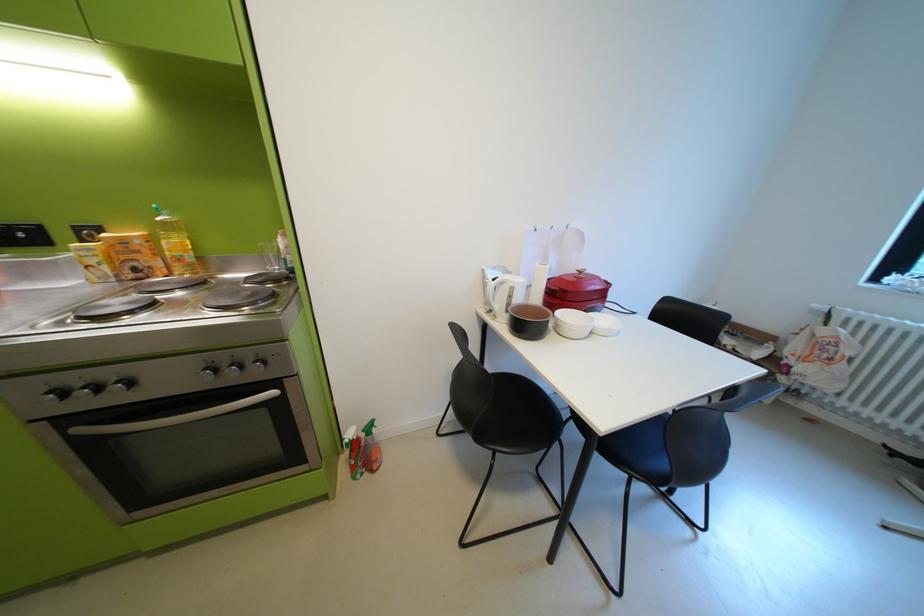
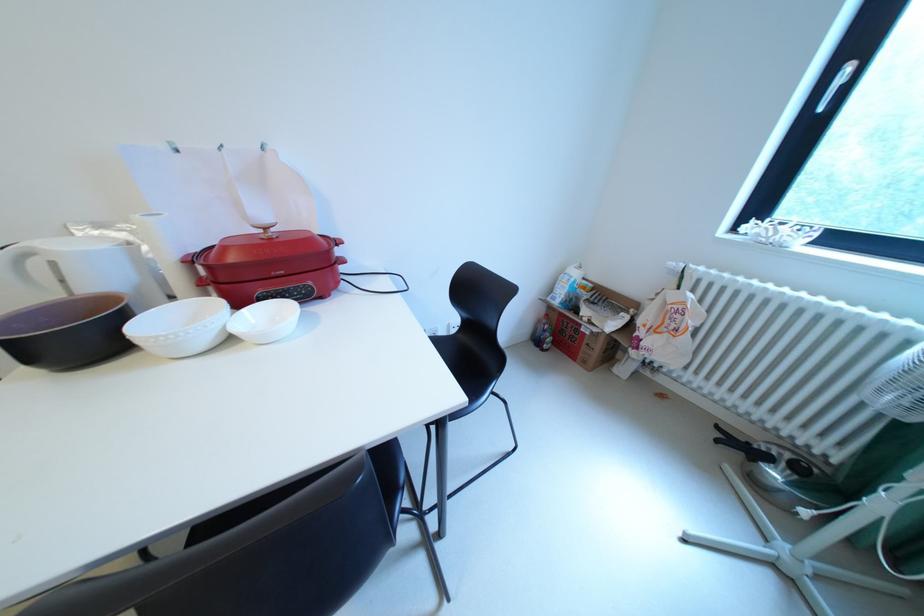
Which direction would the cameraman need to move to produce the second image?

The cameraman walked toward right, forward.